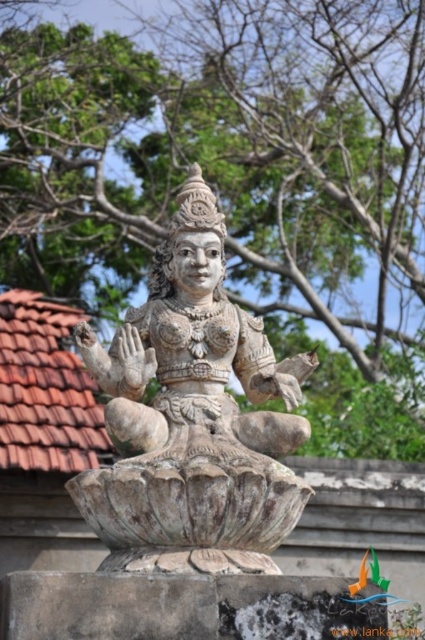
Question: Which object is farther from the camera taking this photo?

Choices:
 (A) green leafy tree at upper center
 (B) stone statue at center

Answer: (A)

Question: Considering the relative positions of green leafy tree at upper center and stone statue at center in the image provided, where is green leafy tree at upper center located with respect to stone statue at center?

Choices:
 (A) above
 (B) below

Answer: (A)

Question: Is green leafy tree at upper center wider than stone statue at center?

Choices:
 (A) yes
 (B) no

Answer: (A)

Question: Is green leafy tree at upper center positioned at the back of stone statue at center?

Choices:
 (A) no
 (B) yes

Answer: (B)